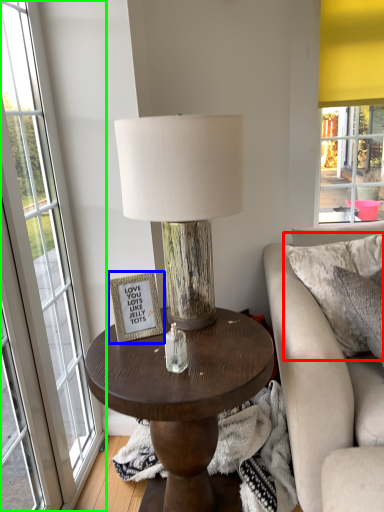
Question: Estimate the real-world distances between objects in this image. Which object is closer to pillow (highlighted by a red box), picture frame (highlighted by a blue box) or window (highlighted by a green box)?

Choices:
 (A) picture frame
 (B) window

Answer: (A)